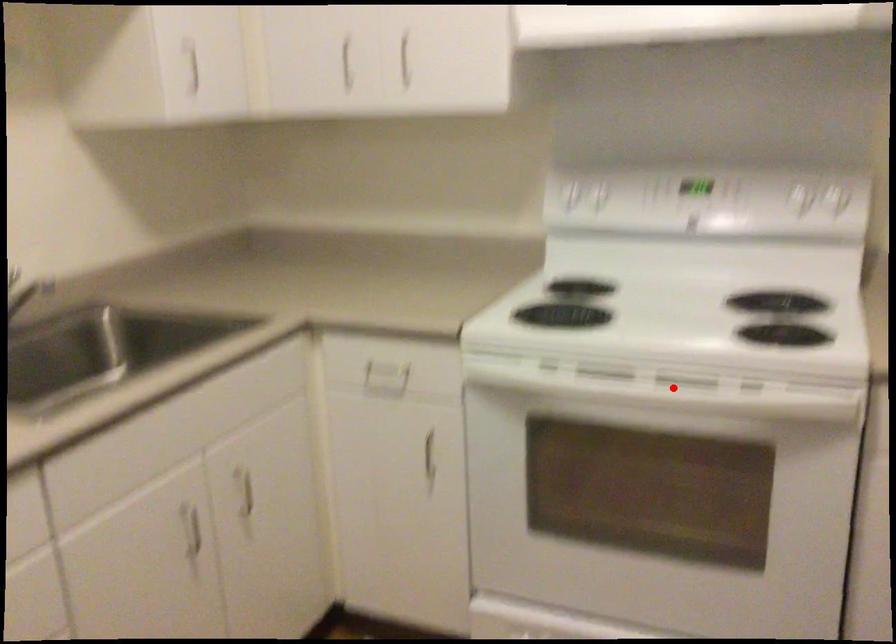
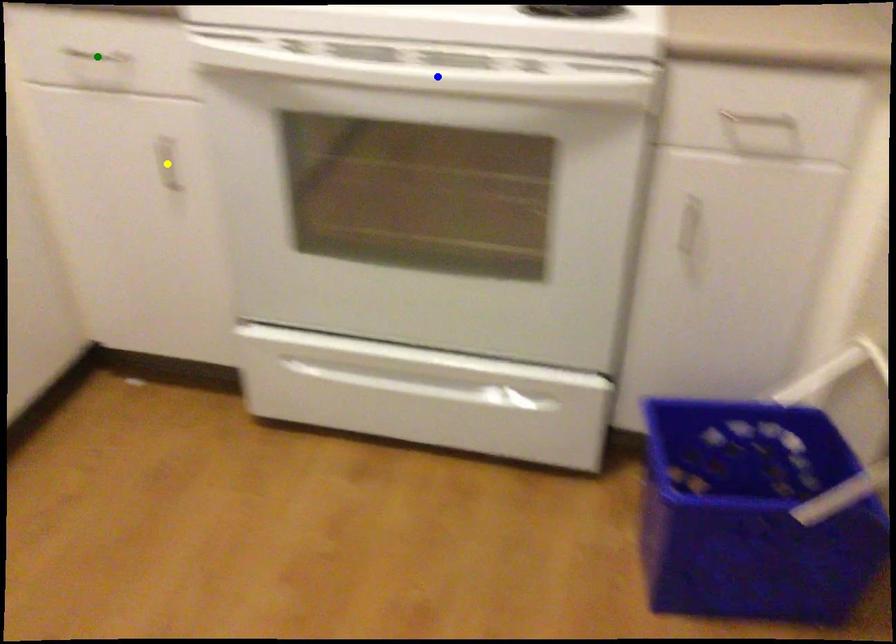
Question: I am providing you with two images of the same scene from different viewpoints. A red point is marked on the first image. You are given multiple points on the second image. Can you choose the point in image 2 that corresponds to the point in image 1?

Choices:
 (A) blue point
 (B) green point
 (C) yellow point

Answer: (A)